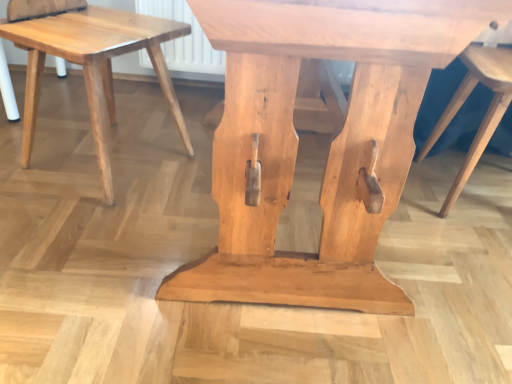
I want to click on vacant space to the right of natural wood stool at lower left, the 2th stool positioned from the right, so click(203, 177).